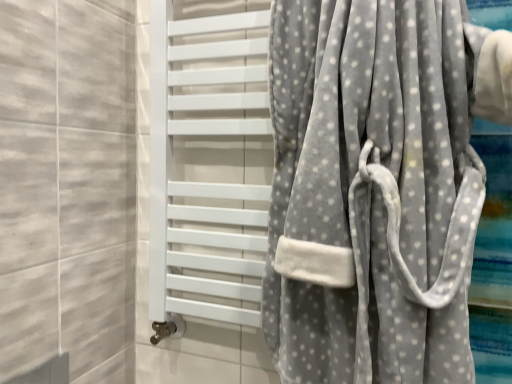
The height and width of the screenshot is (384, 512). What do you see at coordinates (371, 191) in the screenshot?
I see `gray polka dot fabric at center` at bounding box center [371, 191].

Where is `gray polka dot fabric at center`? gray polka dot fabric at center is located at coordinates (371, 191).

Locate an element on the screen. The height and width of the screenshot is (384, 512). gray polka dot fabric at center is located at coordinates (371, 191).